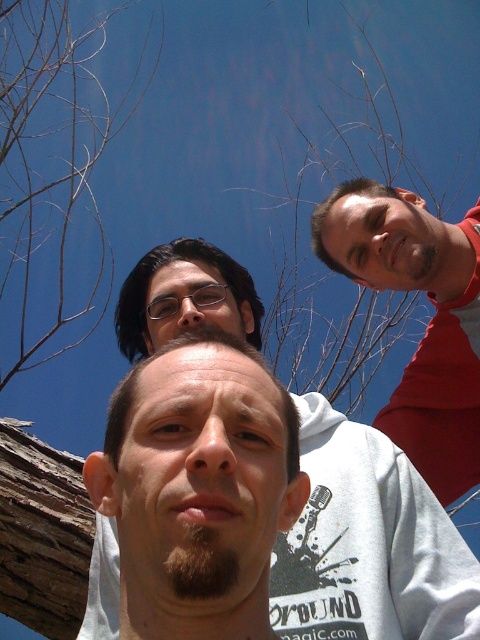
You are a photographer trying to capture a clear shot of the white cotton hoodie at center and the light brown hair at center. Since you want to focus on the details of both objects, which one should you zoom in on more to ensure clarity?

The white cotton hoodie at center is bigger than light brown hair at center, so you should zoom in more on the light brown hair at center to ensure its details are clear.

You are standing below the three people in the scene and want to hand a jacket to the person wearing the white cotton hoodie at center. Based on their position, which direction should you move to reach them?

The white cotton hoodie at center is located at point coordinates, so you should move towards the center area to reach the person wearing it.